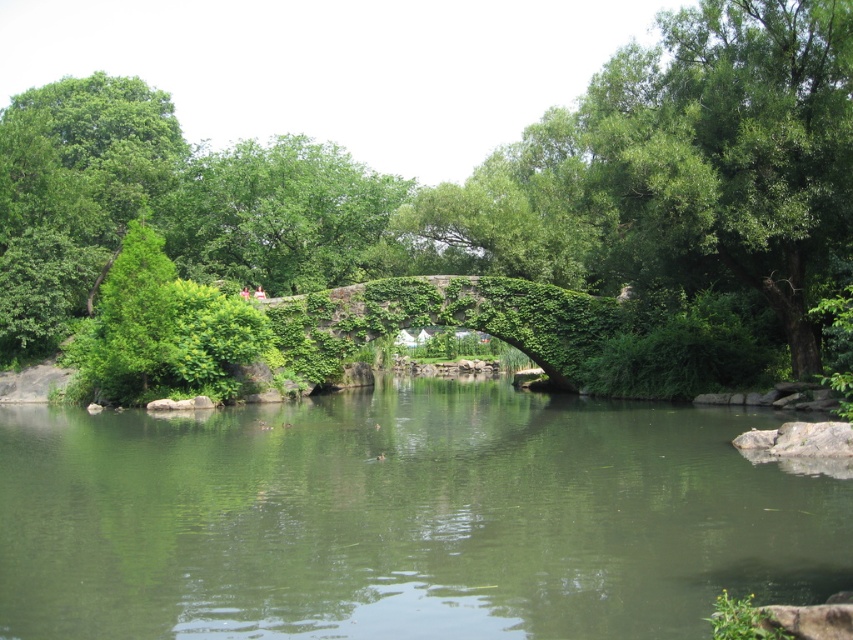
Looking at this image, you are a bird flying over the serene natural scene. You see the green leafy tree at center and the green mossy river at center. Which object is located above the other?

The green leafy tree at center is positioned over green mossy river at center.

You are standing on the stone bridge and want to take a photo of both the green leafy tree at center and the green mossy river at center. Which object should you position to your left side in the camera frame to capture both in the shot?

You should position the green leafy tree at center to your left side in the camera frame because it is already located to the left of the green mossy river at center.